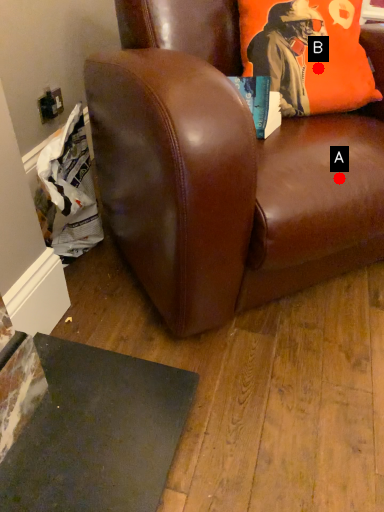
Question: Two points are circled on the image, labeled by A and B beside each circle. Which of the following is the closest to the observer?

Choices:
 (A) A is closer
 (B) B is closer

Answer: (A)